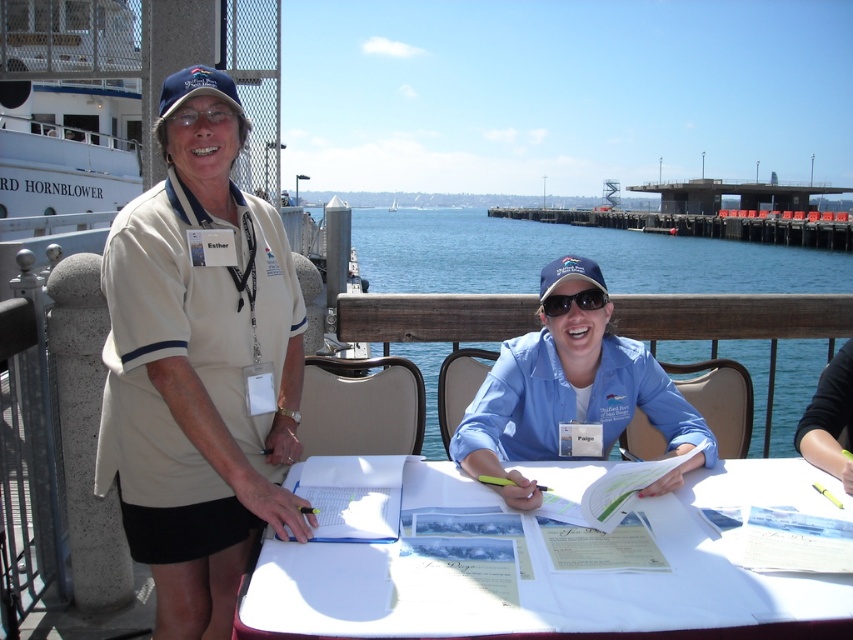
Question: Can you confirm if wooden dock at center is bigger than matte black sunglasses at center?

Choices:
 (A) yes
 (B) no

Answer: (A)

Question: Does beige fabric shirt at left appear under white paper at center?

Choices:
 (A) no
 (B) yes

Answer: (A)

Question: Estimate the real-world distances between objects in this image. Which object is farther from the beige fabric shirt at left?

Choices:
 (A) matte black sunglasses at center
 (B) blue cotton shirt at center

Answer: (A)

Question: Which object is farther from the camera taking this photo?

Choices:
 (A) matte black sunglasses at center
 (B) blue cotton shirt at center
 (C) white paper at center
 (D) wooden dock at center

Answer: (D)

Question: Among these points, which one is nearest to the camera?

Choices:
 (A) (621, 337)
 (B) (457, 291)
 (C) (850, 595)

Answer: (C)

Question: Does blue cotton shirt at center appear on the right side of wooden dock at center?

Choices:
 (A) yes
 (B) no

Answer: (B)